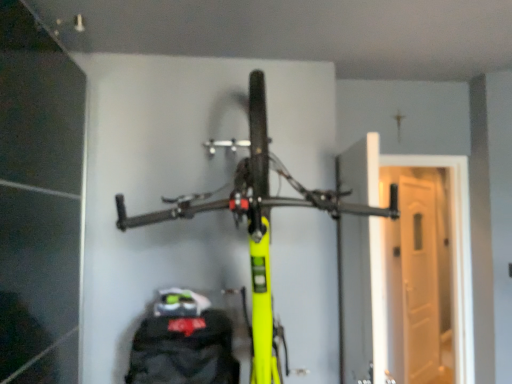
Question: Can you confirm if neon yellow bike at center is bigger than white glossy door at right?

Choices:
 (A) no
 (B) yes

Answer: (B)

Question: Does neon yellow bike at center come behind white glossy door at right?

Choices:
 (A) yes
 (B) no

Answer: (B)

Question: Does neon yellow bike at center appear on the left side of white glossy door at right?

Choices:
 (A) yes
 (B) no

Answer: (A)

Question: Does neon yellow bike at center have a lesser height compared to white glossy door at right?

Choices:
 (A) yes
 (B) no

Answer: (B)

Question: From a real-world perspective, is neon yellow bike at center under white glossy door at right?

Choices:
 (A) yes
 (B) no

Answer: (B)

Question: Is neon yellow bike at center in contact with white glossy door at right?

Choices:
 (A) yes
 (B) no

Answer: (B)

Question: From the image's perspective, is white glossy door at right under neon yellow bike at center?

Choices:
 (A) no
 (B) yes

Answer: (B)

Question: Can you confirm if white glossy door at right is thinner than neon yellow bike at center?

Choices:
 (A) yes
 (B) no

Answer: (A)

Question: Could you tell me if white glossy door at right is turned towards neon yellow bike at center?

Choices:
 (A) yes
 (B) no

Answer: (B)

Question: Is white glossy door at right directly adjacent to neon yellow bike at center?

Choices:
 (A) no
 (B) yes

Answer: (A)

Question: From a real-world perspective, is white glossy door at right over neon yellow bike at center?

Choices:
 (A) no
 (B) yes

Answer: (A)

Question: Can you confirm if white glossy door at right is positioned to the left of neon yellow bike at center?

Choices:
 (A) no
 (B) yes

Answer: (A)

Question: From the image's perspective, is white glossy door at right above or below neon yellow bike at center?

Choices:
 (A) below
 (B) above

Answer: (A)